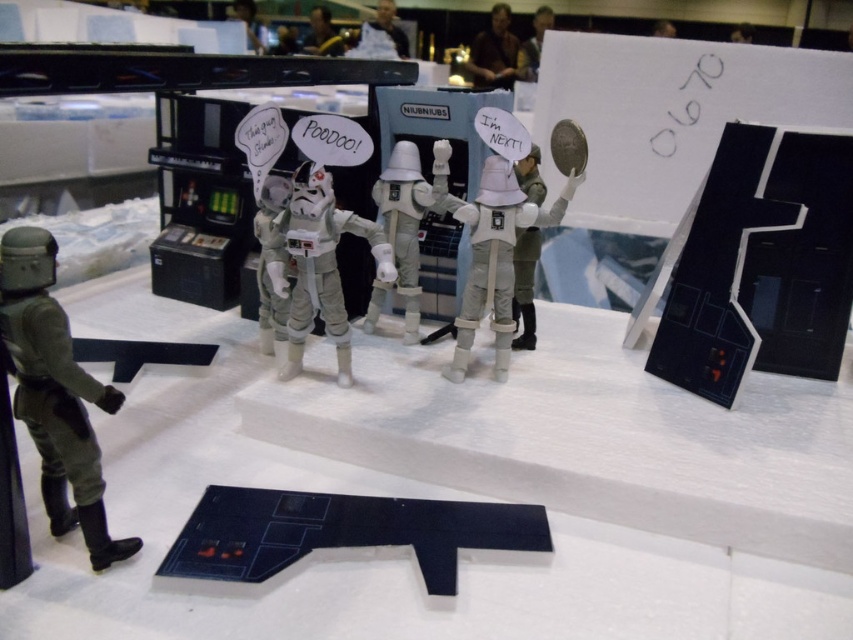
Question: Is white matte stormtrooper at center in front of brown leather jacket at upper center?

Choices:
 (A) no
 (B) yes

Answer: (B)

Question: Which object is the closest to the dark brown leather jacket at upper center?

Choices:
 (A) white matte astronaut at center
 (B) white matte stormtrooper at center
 (C) black plastic base at lower center

Answer: (A)

Question: Which object is farther from the camera taking this photo?

Choices:
 (A) white matte astronaut at center
 (B) matte green figure at left
 (C) black plastic base at lower center
 (D) brown leather jacket at upper center

Answer: (D)

Question: Which object is closer to the camera taking this photo?

Choices:
 (A) black plastic base at lower center
 (B) matte green figure at left

Answer: (B)

Question: Is dark brown leather jacket at upper center closer to camera compared to smooth plastic helmet at upper center?

Choices:
 (A) no
 (B) yes

Answer: (B)

Question: Is white matte astronaut helmet at center bigger than white plastic head at upper center?

Choices:
 (A) yes
 (B) no

Answer: (A)